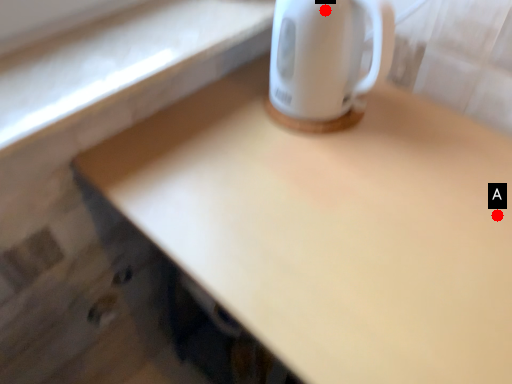
Question: Two points are circled on the image, labeled by A and B beside each circle. Which of the following is the farthest from the observer?

Choices:
 (A) A is further
 (B) B is further

Answer: (B)